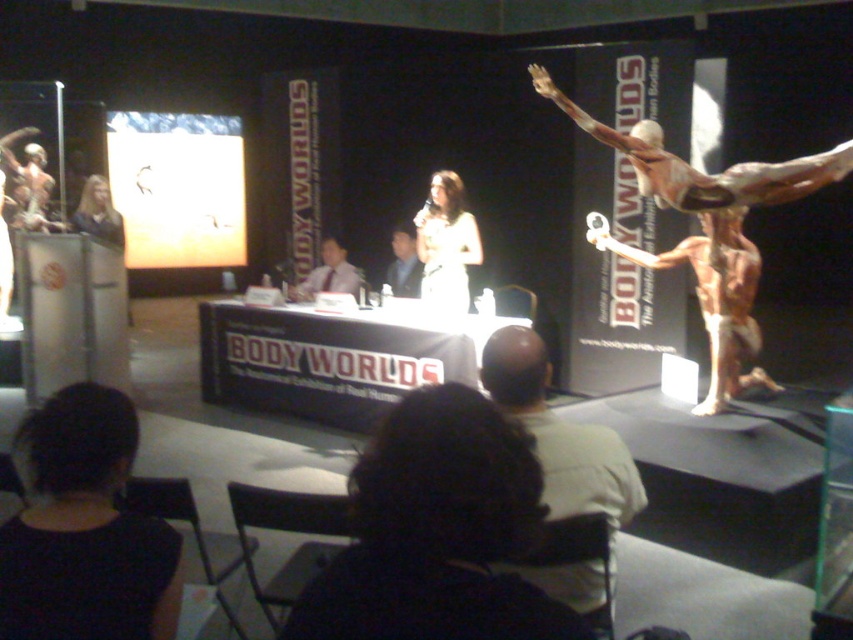
Question: Which point is farther to the camera?

Choices:
 (A) (96, 212)
 (B) (457, 435)
 (C) (329, 250)

Answer: (A)

Question: Is black fabric hair at lower left further to the viewer compared to white silk dress at center?

Choices:
 (A) no
 (B) yes

Answer: (A)

Question: Does black fabric hair at lower left have a larger size compared to white silk dress at center?

Choices:
 (A) no
 (B) yes

Answer: (A)

Question: Which of the following is the closest to the observer?

Choices:
 (A) dark curly hair at lower center
 (B) light green shirt at center
 (C) black fabric hair at lower left
 (D) matte white shirt at center

Answer: (A)

Question: Which object is positioned closest to the light green shirt at center?

Choices:
 (A) matte white shirt at center
 (B) black fabric hair at lower left

Answer: (B)

Question: Is black fabric hair at lower left further to the viewer compared to light green shirt at center?

Choices:
 (A) yes
 (B) no

Answer: (B)